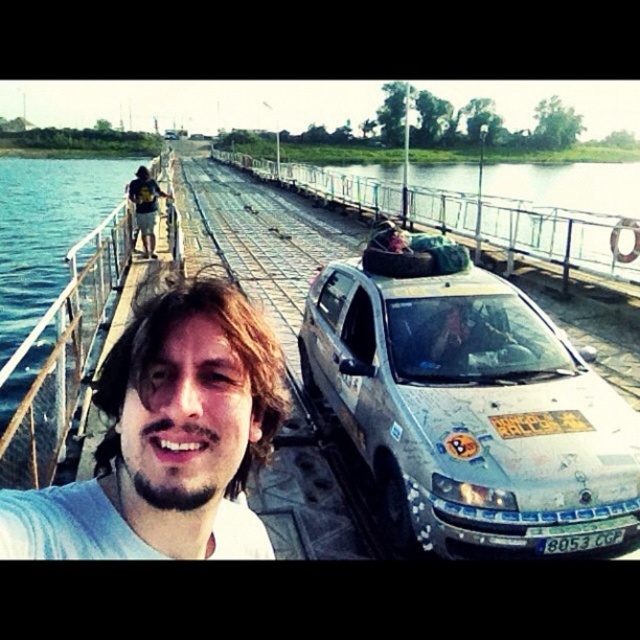
Can you confirm if silver metallic car at center is positioned to the right of light brown hair at center?

Correct, you'll find silver metallic car at center to the right of light brown hair at center.

Is silver metallic car at center thinner than light brown hair at center?

No.

Locate an element on the screen. silver metallic car at center is located at coordinates (468, 410).

Between silver metallic car at center and white plastic license plate at center, which one appears on the right side from the viewer's perspective?

From the viewer's perspective, white plastic license plate at center appears more on the right side.

I want to click on silver metallic car at center, so click(468, 410).

Based on the photo, does light brown hair at center have a lesser width compared to white plastic license plate at center?

In fact, light brown hair at center might be wider than white plastic license plate at center.

Who is shorter, light brown hair at center or white plastic license plate at center?

white plastic license plate at center is shorter.

Is point (218, 525) positioned before point (600, 536)?

Yes.

Locate an element on the screen. light brown hair at center is located at coordinates (168, 440).